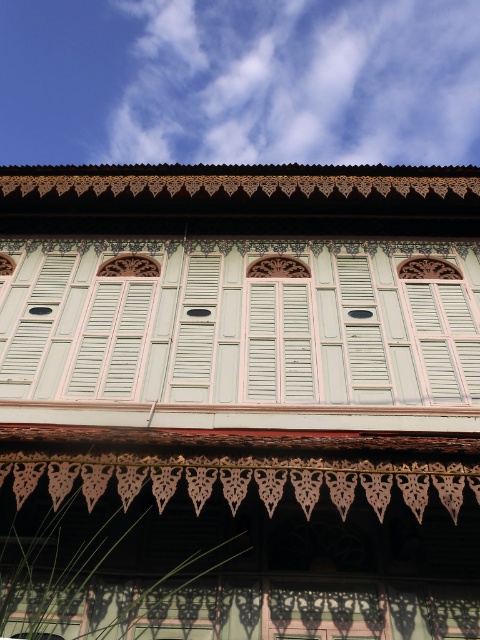
Describe the element at coordinates (278, 342) in the screenshot. The height and width of the screenshot is (640, 480). I see `white matte shutters at center` at that location.

Who is positioned more to the left, white matte shutters at center or light green wood at center?

From the viewer's perspective, light green wood at center appears more on the left side.

Describe the element at coordinates (278, 342) in the screenshot. I see `white matte shutters at center` at that location.

The width and height of the screenshot is (480, 640). Find the location of `white matte shutters at center`. white matte shutters at center is located at coordinates (278, 342).

Does white fluffy cloud at upper center have a greater width compared to light green wood at center?

Indeed, white fluffy cloud at upper center has a greater width compared to light green wood at center.

Between point (323, 4) and point (195, 307), which one is positioned in front?

Point (195, 307) is more forward.

Where is `white fluffy cloud at upper center`? Image resolution: width=480 pixels, height=640 pixels. white fluffy cloud at upper center is located at coordinates (299, 83).

Does light green wood shutters at center appear over white matte shutters at center?

Yes.

Is light green wood shutters at center wider than white matte shutters at center?

No, light green wood shutters at center is not wider than white matte shutters at center.

Consider the image. Who is more distant from viewer, (165, 300) or (274, 288)?

The point (274, 288) is more distant.

Where is `light green wood shutters at center`? This screenshot has width=480, height=640. light green wood shutters at center is located at coordinates (239, 323).